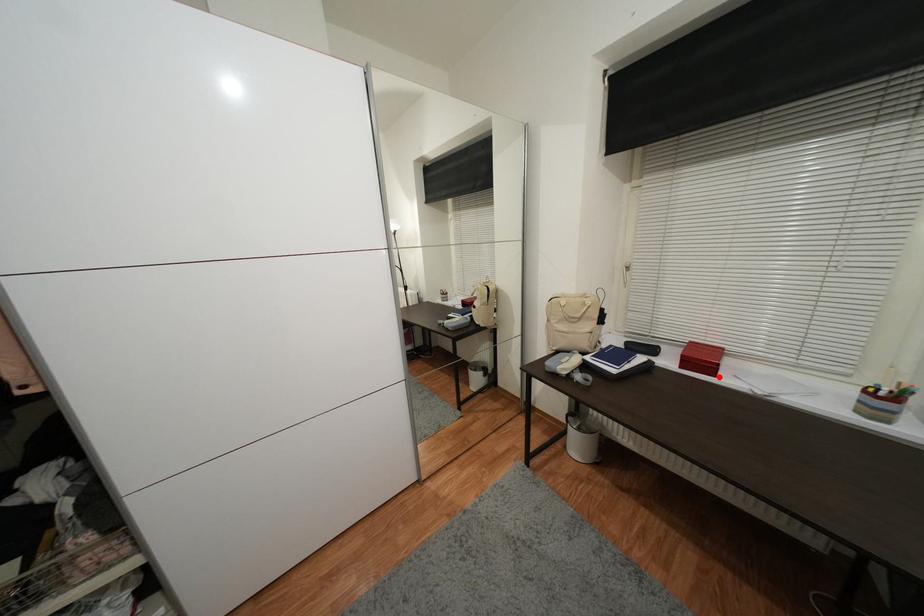
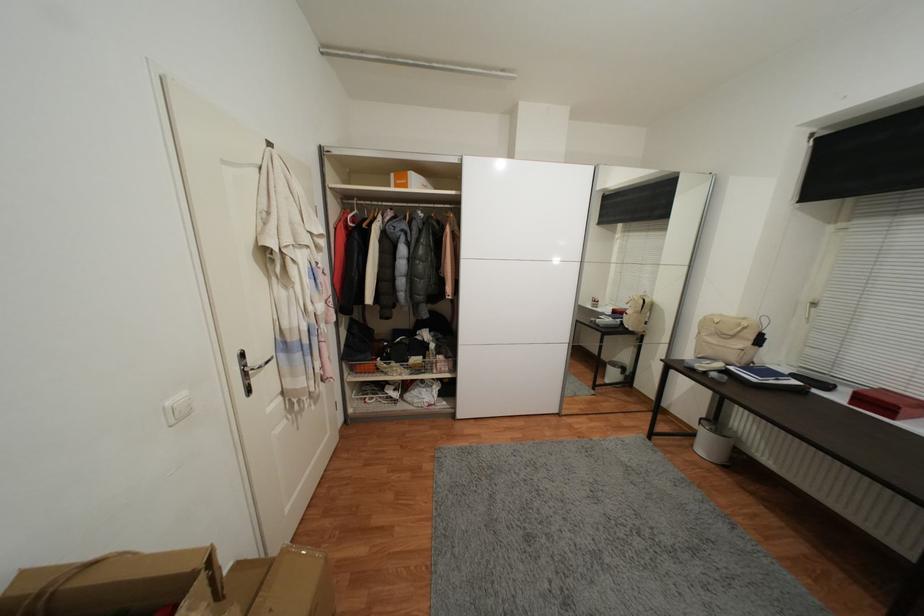
The point at the highlighted location is marked in the first image. Where is the corresponding point in the second image?

(897, 419)